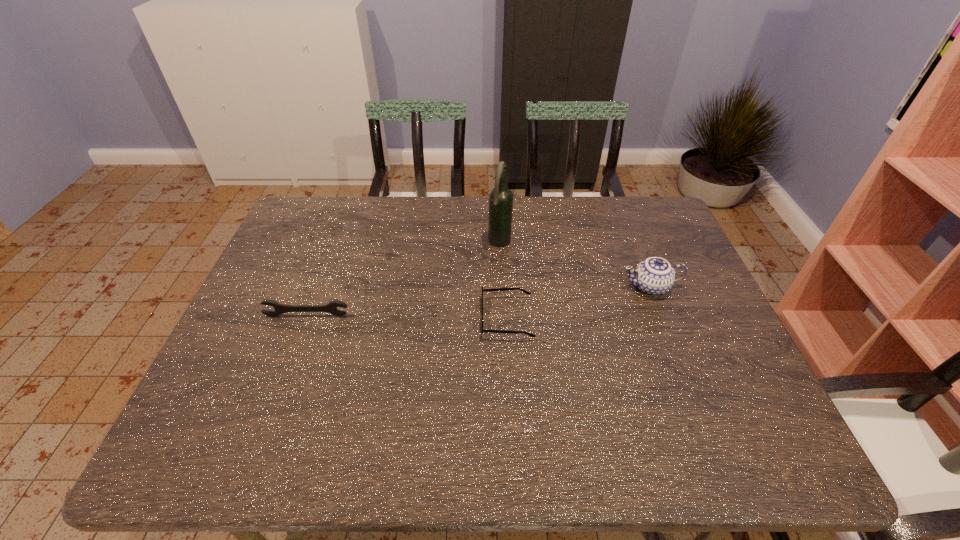
Find the location of a particular element. This screenshot has height=540, width=960. the tallest object is located at coordinates (501, 197).

Find the location of `beer bottle`. beer bottle is located at coordinates (501, 197).

Locate an element on the screen. the third shortest object is located at coordinates (654, 276).

You are a GUI agent. You are given a task and a screenshot of the screen. Output one action in this format:
    pyautogui.click(x=<x>, y=<y>)
    Task: Click on the chinaware
    The width and height of the screenshot is (960, 540).
    Given the screenshot: What is the action you would take?
    pyautogui.click(x=654, y=276)

This screenshot has width=960, height=540. Find the location of `the third tallest object`. the third tallest object is located at coordinates (279, 308).

Image resolution: width=960 pixels, height=540 pixels. I want to click on the leftmost object, so click(x=279, y=308).

Locate an element on the screen. sunglasses is located at coordinates (496, 289).

Where is `vacant space located on the back of the farthest object`? vacant space located on the back of the farthest object is located at coordinates (498, 224).

You are a GUI agent. You are given a task and a screenshot of the screen. Output one action in this format:
    pyautogui.click(x=<x>, y=<y>)
    Task: Click on the free location located 0.320m from the spout of the chinaware
    Image resolution: width=960 pixels, height=540 pixels.
    Given the screenshot: What is the action you would take?
    505,287

The width and height of the screenshot is (960, 540). I want to click on vacant position located from the spout of the chinaware, so click(555, 287).